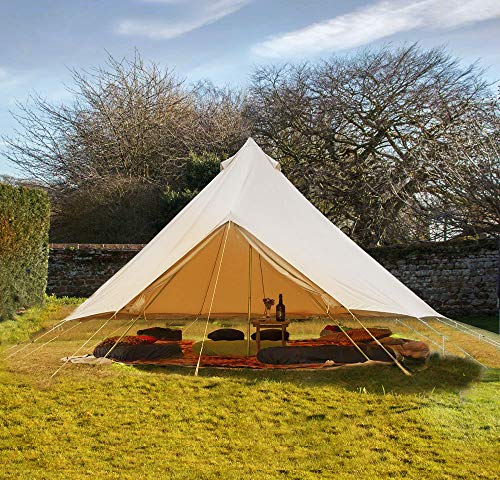
Identify the location of small table with vase and wine on top of it. This screenshot has width=500, height=480. (267, 320).